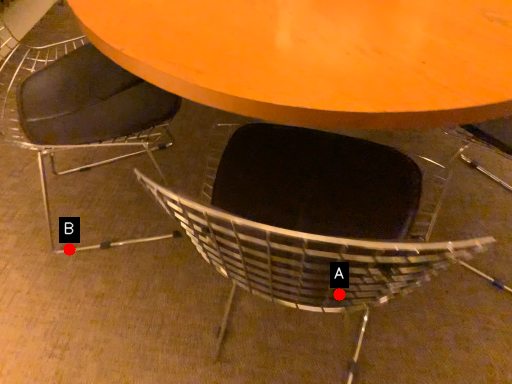
Question: Two points are circled on the image, labeled by A and B beside each circle. Which point is further to the camera?

Choices:
 (A) A is further
 (B) B is further

Answer: (B)